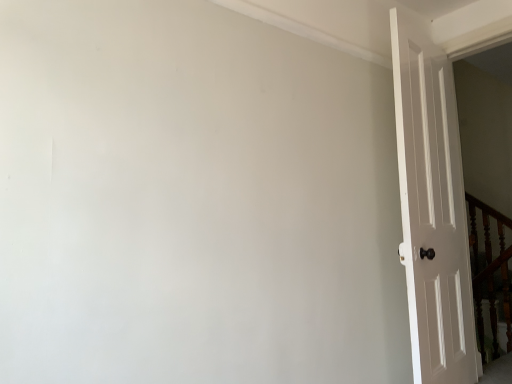
Where is `brown wooden rail at right`? This screenshot has width=512, height=384. brown wooden rail at right is located at coordinates (490, 272).

In order to face brown wooden rail at right, should I rotate leftwards or rightwards?

Rotate right and turn 29.371 degrees.

Describe the element at coordinates (490, 272) in the screenshot. Image resolution: width=512 pixels, height=384 pixels. I see `brown wooden rail at right` at that location.

This screenshot has height=384, width=512. What are the coordinates of `brown wooden rail at right` in the screenshot? It's located at (490, 272).